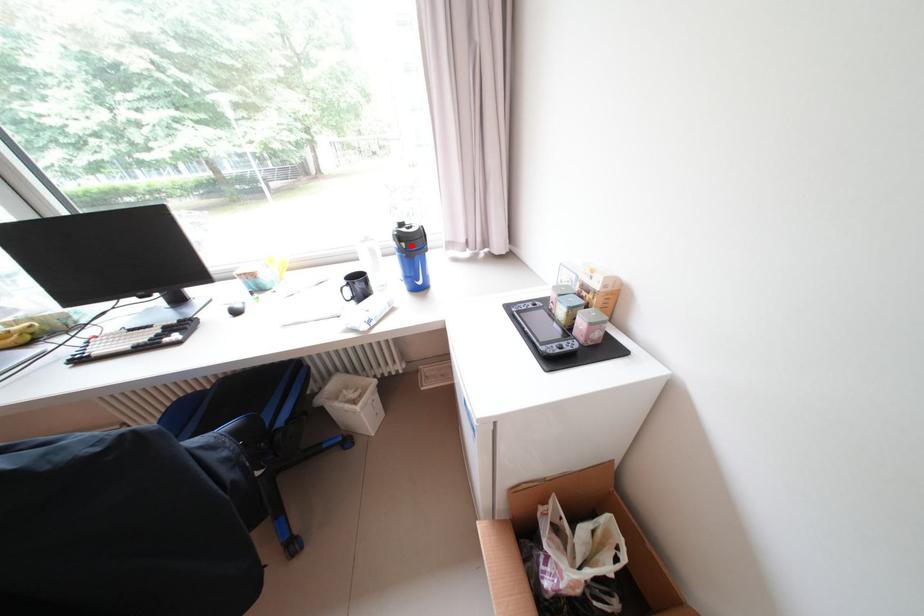
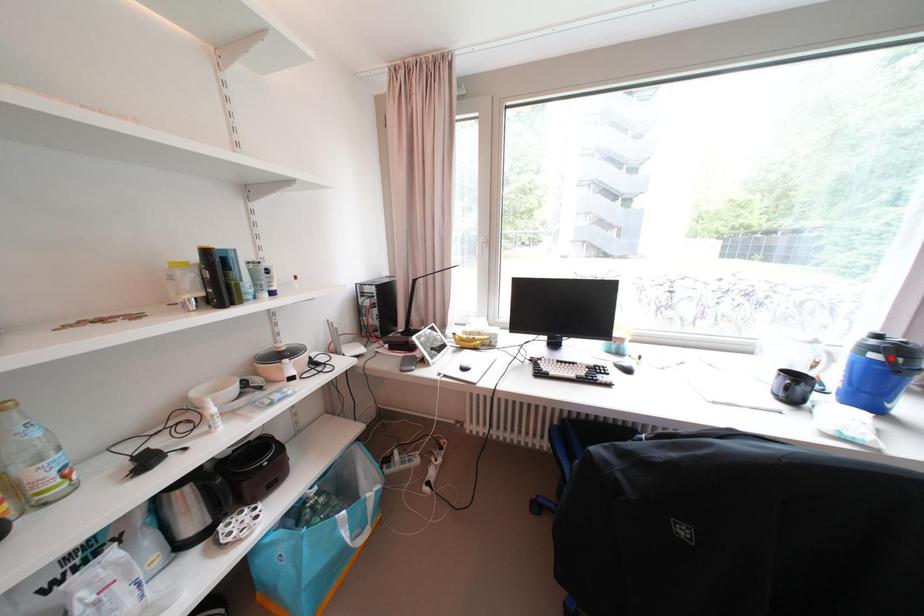
I am providing you with two images of the same scene from different viewpoints. A red point is marked on the first image and another point is marked on the second image. Is the red point in image1 aligned with the point shown in image2?

No